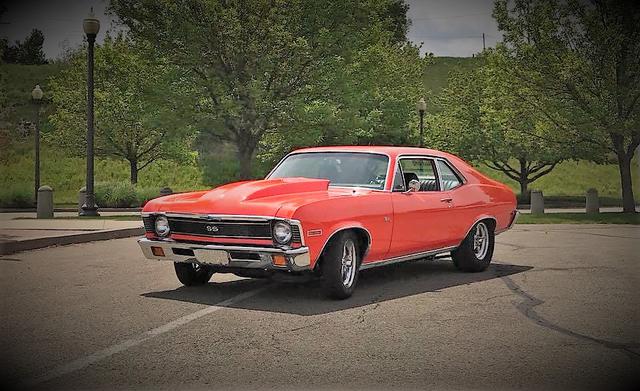
Locate an element on the screen. This screenshot has height=391, width=640. trash receptacle is located at coordinates (47, 201), (82, 194), (534, 198), (595, 202).